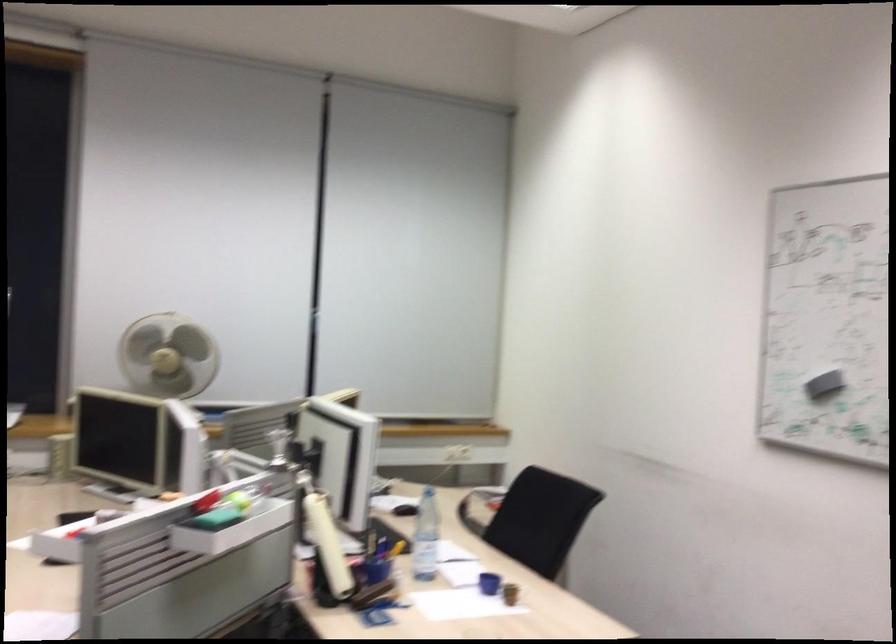
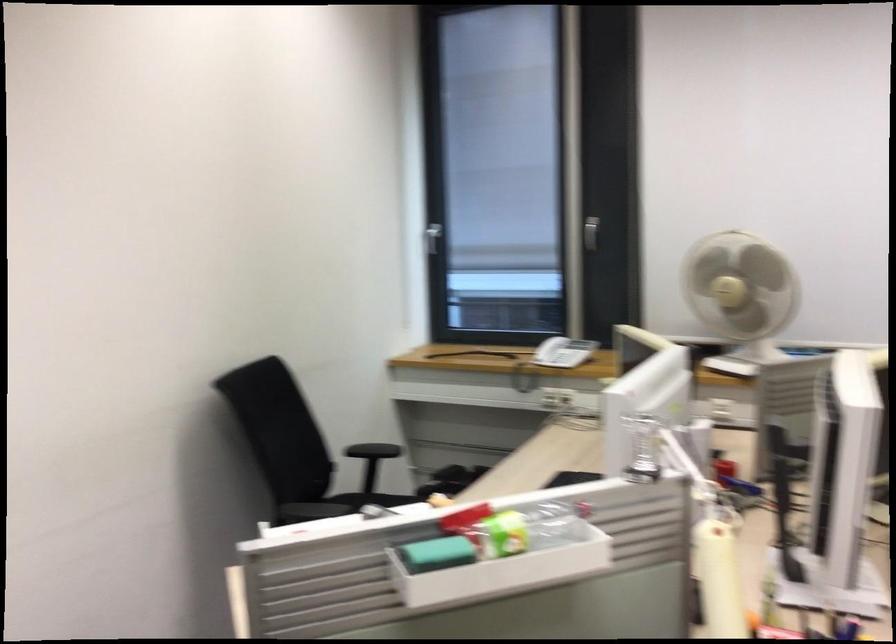
Where in the second image is the point corresponding to point 87,529 from the first image?

(367, 509)